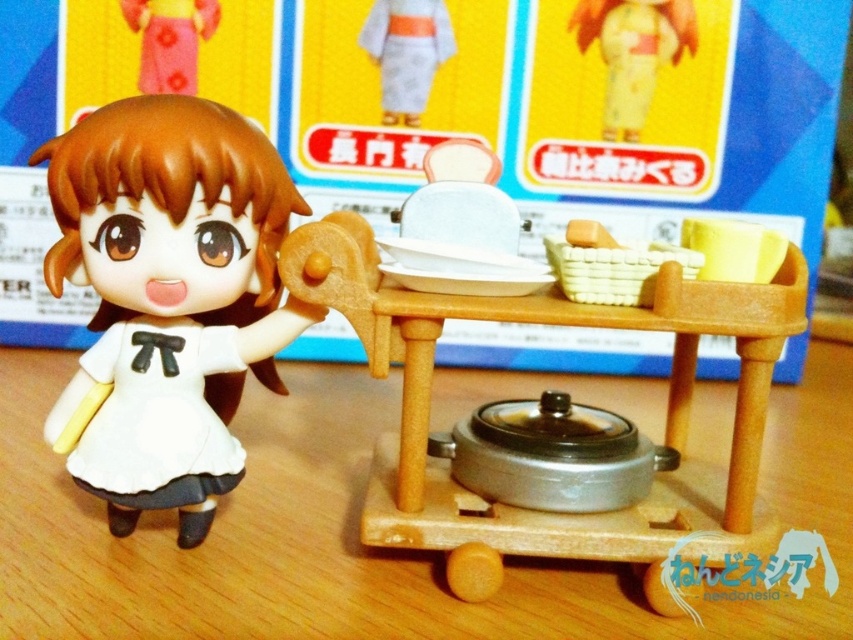
Question: Among these points, which one is farthest from the camera?

Choices:
 (A) (413, 76)
 (B) (689, 488)
 (C) (154, 29)

Answer: (A)

Question: Is white matte doll at left smaller than wooden table at center?

Choices:
 (A) yes
 (B) no

Answer: (A)

Question: Is wooden table at center wider than yellow matte kimono at upper center?

Choices:
 (A) no
 (B) yes

Answer: (B)

Question: Is wooden table at center to the right of pink fabric dress at upper left from the viewer's perspective?

Choices:
 (A) yes
 (B) no

Answer: (A)

Question: Among these points, which one is farthest from the camera?

Choices:
 (A) (146, 451)
 (B) (670, 29)
 (C) (741, 273)

Answer: (B)

Question: Among these objects, which one is farthest from the camera?

Choices:
 (A) white matte doll at left
 (B) white fabric kimono at upper center
 (C) yellow matte cup at upper right
 (D) wooden table at center

Answer: (B)